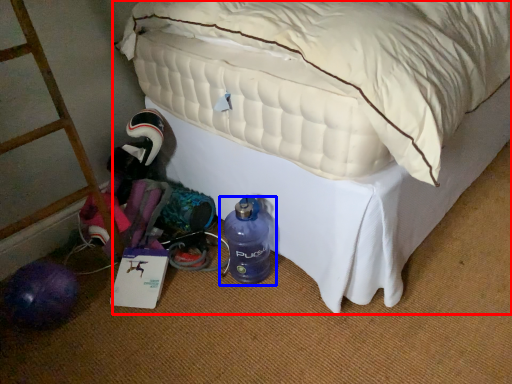
Question: Which object appears closest to the camera in this image, bed (highlighted by a red box) or bottle (highlighted by a blue box)?

Choices:
 (A) bed
 (B) bottle

Answer: (A)